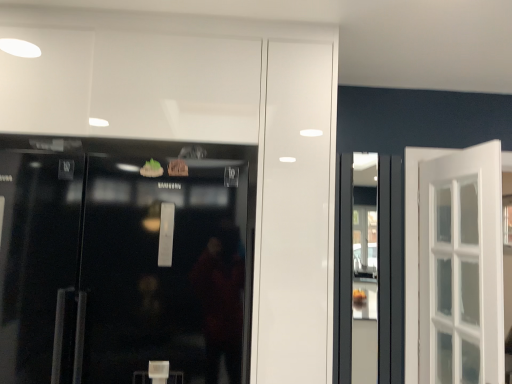
Question: Considering the positions of transparent glass shop window at center and black glass refrigerator at left in the image, is transparent glass shop window at center bigger or smaller than black glass refrigerator at left?

Choices:
 (A) big
 (B) small

Answer: (B)

Question: Which is correct: transparent glass shop window at center is inside black glass refrigerator at left, or outside of it?

Choices:
 (A) outside
 (B) inside

Answer: (A)

Question: In terms of height, does transparent glass shop window at center look taller or shorter compared to black glass refrigerator at left?

Choices:
 (A) short
 (B) tall

Answer: (B)

Question: Do you think black glass refrigerator at left is within transparent glass shop window at center, or outside of it?

Choices:
 (A) outside
 (B) inside

Answer: (A)

Question: In the image, is black glass refrigerator at left positioned in front of or behind transparent glass shop window at center?

Choices:
 (A) front
 (B) behind

Answer: (A)

Question: From a real-world perspective, relative to transparent glass shop window at center, is black glass refrigerator at left vertically above or below?

Choices:
 (A) above
 (B) below

Answer: (A)

Question: From their relative heights in the image, would you say black glass refrigerator at left is taller or shorter than transparent glass shop window at center?

Choices:
 (A) short
 (B) tall

Answer: (A)